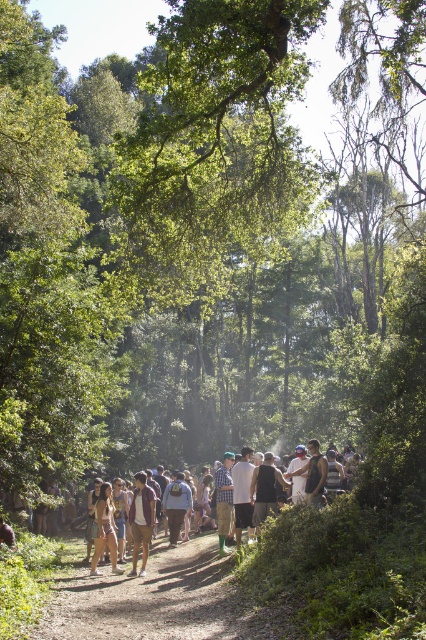
You are a photographer standing on the path in the forest. You notice two people wearing shirts with different patterns. The first person is wearing a purple fabric shirt at center, and the second person is wearing a checkered fabric shirt at center. Which shirt is higher up in the image?

The purple fabric shirt at center is above the checkered fabric shirt at center in the image.